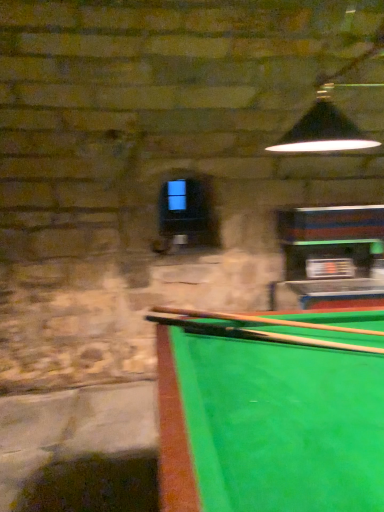
The height and width of the screenshot is (512, 384). Identify the location of smooth wood cue at center, acting as the second cue starting from the bottom. (255, 334).

Consider the image. What is the approximate height of wooden cue at lower right, the 3th cue when ordered from top to bottom?

wooden cue at lower right, the 3th cue when ordered from top to bottom, is 4.07 centimeters in height.

In order to click on smooth wood cue at center, which is counted as the second cue, starting from the top in this screenshot , I will do `click(255, 334)`.

From a real-world perspective, count 1st cues downward from the wooden cue at center, arranged as the third cue when ordered from the bottom, and point to it. Please provide its 2D coordinates.

[(255, 334)]

Are smooth wood cue at center, acting as the second cue starting from the bottom, and wooden cue at center, arranged as the 1th cue when viewed from the top, beside each other?

Yes, smooth wood cue at center, acting as the second cue starting from the bottom, is in contact with wooden cue at center, arranged as the 1th cue when viewed from the top.

Considering the sizes of objects smooth wood cue at center, acting as the second cue starting from the bottom, and wooden cue at center, arranged as the third cue when ordered from the bottom, in the image provided, who is bigger, smooth wood cue at center, acting as the second cue starting from the bottom, or wooden cue at center, arranged as the third cue when ordered from the bottom,?

wooden cue at center, arranged as the third cue when ordered from the bottom, is bigger.

In the scene shown: From a real-world perspective, is smooth wood cue at center, which is counted as the second cue, starting from the top, beneath wooden cue at center, arranged as the third cue when ordered from the bottom?

Yes, from a real-world perspective, smooth wood cue at center, which is counted as the second cue, starting from the top, is below wooden cue at center, arranged as the third cue when ordered from the bottom.

How far apart are smooth wood cue at center, acting as the second cue starting from the bottom, and wooden cue at lower right, the 3th cue when ordered from top to bottom?

The distance of smooth wood cue at center, acting as the second cue starting from the bottom, from wooden cue at lower right, the 3th cue when ordered from top to bottom, is 4.58 centimeters.

Would you say wooden cue at lower right, the 3th cue when ordered from top to bottom, is part of smooth wood cue at center, acting as the second cue starting from the bottom,'s contents?

No, wooden cue at lower right, the 3th cue when ordered from top to bottom, is not inside smooth wood cue at center, acting as the second cue starting from the bottom.

Is smooth wood cue at center, acting as the second cue starting from the bottom, beside wooden cue at lower right, which is counted as the first cue, starting from the bottom?

Yes.

Is smooth wood cue at center, acting as the second cue starting from the bottom, shorter than wooden cue at lower right, which is counted as the first cue, starting from the bottom?

Correct, smooth wood cue at center, acting as the second cue starting from the bottom, is not as tall as wooden cue at lower right, which is counted as the first cue, starting from the bottom.

From a real-world perspective, starting from the wooden cue at lower right, the 3th cue when ordered from top to bottom, which cue is the 2nd one vertically above it? Please provide its 2D coordinates.

[(257, 320)]

Which is behind, point (267, 321) or point (255, 332)?

The point (267, 321) is farther from the camera.

Can you confirm if wooden cue at center, arranged as the third cue when ordered from the bottom, is bigger than wooden cue at lower right, which is counted as the first cue, starting from the bottom?

Yes, wooden cue at center, arranged as the third cue when ordered from the bottom, is bigger than wooden cue at lower right, which is counted as the first cue, starting from the bottom.

From the image's perspective, is wooden cue at center, arranged as the 1th cue when viewed from the top, above or below wooden cue at lower right, the 3th cue when ordered from top to bottom?

From the image's perspective, wooden cue at center, arranged as the 1th cue when viewed from the top, appears above wooden cue at lower right, the 3th cue when ordered from top to bottom.

From a real-world perspective, which object rests below the other?

From a 3D spatial view, wooden cue at lower right, which is counted as the first cue, starting from the bottom, is below.

Locate an element on the screen. The image size is (384, 512). the 1st cue in front when counting from the wooden cue at center, arranged as the third cue when ordered from the bottom is located at coordinates (298, 340).

How many degrees apart are the facing directions of wooden cue at lower right, which is counted as the first cue, starting from the bottom, and wooden cue at center, arranged as the third cue when ordered from the bottom?

The facing directions of wooden cue at lower right, which is counted as the first cue, starting from the bottom, and wooden cue at center, arranged as the third cue when ordered from the bottom, are 2.21 degrees apart.

Between wooden cue at lower right, the 3th cue when ordered from top to bottom, and wooden cue at center, arranged as the third cue when ordered from the bottom, which one appears on the right side from the viewer's perspective?

From the viewer's perspective, wooden cue at lower right, the 3th cue when ordered from top to bottom, appears more on the right side.

Is wooden cue at center, arranged as the third cue when ordered from the bottom, not near smooth wood cue at center, which is counted as the second cue, starting from the top?

No, wooden cue at center, arranged as the third cue when ordered from the bottom, is not far away from smooth wood cue at center, which is counted as the second cue, starting from the top.

Considering the sizes of wooden cue at center, arranged as the third cue when ordered from the bottom, and smooth wood cue at center, acting as the second cue starting from the bottom, in the image, is wooden cue at center, arranged as the third cue when ordered from the bottom, taller or shorter than smooth wood cue at center, acting as the second cue starting from the bottom,?

In the image, wooden cue at center, arranged as the third cue when ordered from the bottom, appears to be taller than smooth wood cue at center, acting as the second cue starting from the bottom.

Is wooden cue at center, arranged as the third cue when ordered from the bottom, oriented away from smooth wood cue at center, acting as the second cue starting from the bottom?

That's not correct — wooden cue at center, arranged as the third cue when ordered from the bottom, is not looking away from smooth wood cue at center, acting as the second cue starting from the bottom.

Is smooth wood cue at center, acting as the second cue starting from the bottom, inside wooden cue at center, arranged as the third cue when ordered from the bottom?

Definitely not — smooth wood cue at center, acting as the second cue starting from the bottom, is not inside wooden cue at center, arranged as the third cue when ordered from the bottom.

From the image's perspective, who appears lower, wooden cue at lower right, which is counted as the first cue, starting from the bottom, or smooth wood cue at center, which is counted as the second cue, starting from the top?

wooden cue at lower right, which is counted as the first cue, starting from the bottom, appears lower in the image.

Considering the relative sizes of wooden cue at lower right, which is counted as the first cue, starting from the bottom, and smooth wood cue at center, acting as the second cue starting from the bottom, in the image provided, is wooden cue at lower right, which is counted as the first cue, starting from the bottom, thinner than smooth wood cue at center, acting as the second cue starting from the bottom,?

Yes.

Are wooden cue at lower right, which is counted as the first cue, starting from the bottom, and smooth wood cue at center, which is counted as the second cue, starting from the top, making contact?

Yes, wooden cue at lower right, which is counted as the first cue, starting from the bottom, is with smooth wood cue at center, which is counted as the second cue, starting from the top.

Image resolution: width=384 pixels, height=512 pixels. What are the coordinates of `cue that is the 2nd object located behind the smooth wood cue at center, acting as the second cue starting from the bottom` in the screenshot? It's located at (257, 320).

In order to click on cue that is the 1st one above the wooden cue at lower right, the 3th cue when ordered from top to bottom (from a real-world perspective) in this screenshot , I will do `click(255, 334)`.

From the image, which object appears to be nearer to wooden cue at lower right, the 3th cue when ordered from top to bottom, wooden cue at center, arranged as the third cue when ordered from the bottom, or smooth wood cue at center, acting as the second cue starting from the bottom?

smooth wood cue at center, acting as the second cue starting from the bottom, lies closer to wooden cue at lower right, the 3th cue when ordered from top to bottom, than the other object.

Considering their positions, is smooth wood cue at center, acting as the second cue starting from the bottom, positioned closer to wooden cue at lower right, the 3th cue when ordered from top to bottom, than wooden cue at center, arranged as the 1th cue when viewed from the top?

The object closer to wooden cue at lower right, the 3th cue when ordered from top to bottom, is smooth wood cue at center, acting as the second cue starting from the bottom.

From the image, which object appears to be farther from wooden cue at center, arranged as the third cue when ordered from the bottom, wooden cue at lower right, which is counted as the first cue, starting from the bottom, or smooth wood cue at center, which is counted as the second cue, starting from the top?

Based on the image, wooden cue at lower right, which is counted as the first cue, starting from the bottom, appears to be further to wooden cue at center, arranged as the third cue when ordered from the bottom.

In the scene shown: When comparing their distances from smooth wood cue at center, acting as the second cue starting from the bottom, does wooden cue at center, arranged as the third cue when ordered from the bottom, or wooden cue at lower right, the 3th cue when ordered from top to bottom, seem closer?

wooden cue at lower right, the 3th cue when ordered from top to bottom, lies closer to smooth wood cue at center, acting as the second cue starting from the bottom, than the other object.

Estimate the real-world distances between objects in this image. Which object is further from wooden cue at center, arranged as the third cue when ordered from the bottom, smooth wood cue at center, which is counted as the second cue, starting from the top, or wooden cue at lower right, which is counted as the first cue, starting from the bottom?

wooden cue at lower right, which is counted as the first cue, starting from the bottom, lies further to wooden cue at center, arranged as the third cue when ordered from the bottom, than the other object.

Which object lies nearer to the anchor point smooth wood cue at center, acting as the second cue starting from the bottom, wooden cue at lower right, which is counted as the first cue, starting from the bottom, or wooden cue at center, arranged as the 1th cue when viewed from the top?

The object closer to smooth wood cue at center, acting as the second cue starting from the bottom, is wooden cue at lower right, which is counted as the first cue, starting from the bottom.

Locate an element on the screen. cue located between smooth wood cue at center, acting as the second cue starting from the bottom, and wooden cue at center, arranged as the third cue when ordered from the bottom, in the depth direction is located at coordinates (298, 340).